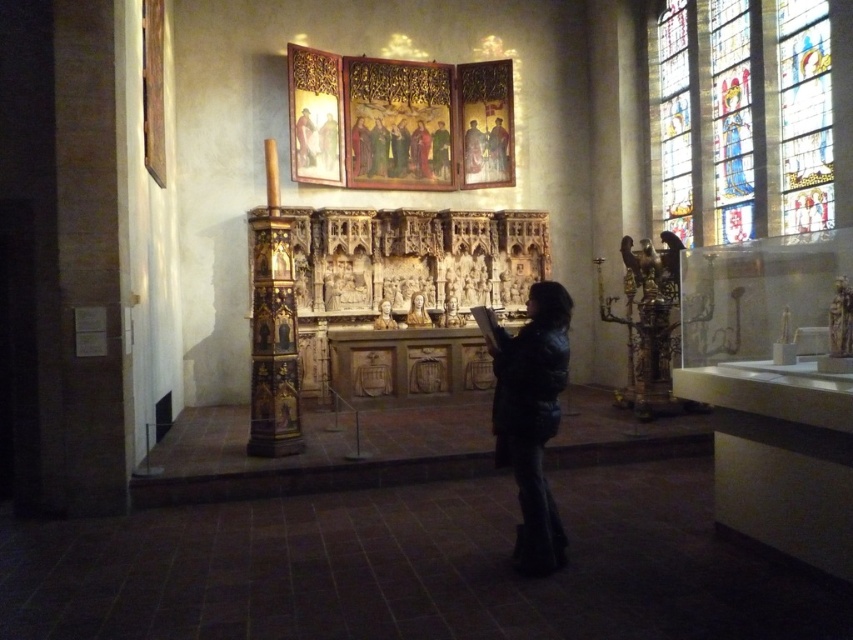
Question: Does matte wooden figure at upper center have a smaller size compared to matte wood painting at upper center?

Choices:
 (A) no
 (B) yes

Answer: (A)

Question: Which of the following is the closest to the observer?

Choices:
 (A) (471, 120)
 (B) (558, 552)

Answer: (B)

Question: Which object is positioned farthest from the stained glass window at upper right?

Choices:
 (A) wooden statue at center
 (B) black leather jacket at center
 (C) matte wooden figure at upper center
 (D) matte wood painting at upper center

Answer: (C)

Question: Does stained glass window at upper right appear on the left side of wooden statue at center?

Choices:
 (A) yes
 (B) no

Answer: (B)

Question: Can you confirm if black leather jacket at center is smaller than matte wooden figure at upper center?

Choices:
 (A) yes
 (B) no

Answer: (B)

Question: Which point is farther from the camera taking this photo?

Choices:
 (A) (502, 420)
 (B) (315, 150)
 (C) (496, 141)

Answer: (C)